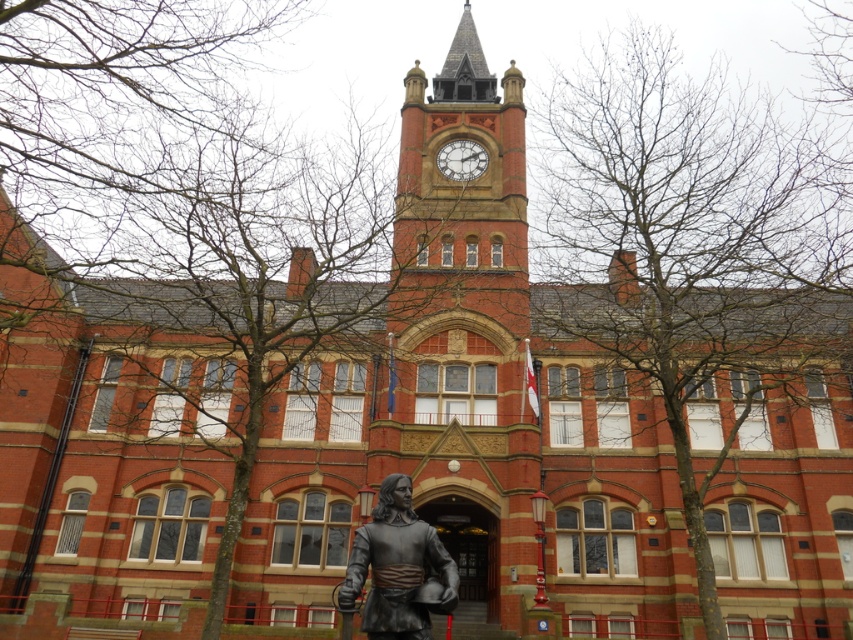
What are the coordinates of `bare branches at upper center` in the screenshot? It's located at (695, 246).

Locate an element on the screen. The image size is (853, 640). bare branches at upper center is located at coordinates (695, 246).

Does bare branches at upper center appear under bronze statue at center?

Actually, bare branches at upper center is above bronze statue at center.

Identify the location of bare branches at upper center. (695, 246).

The image size is (853, 640). What are the coordinates of `bare branches at upper center` in the screenshot? It's located at (695, 246).

Which of these two, bare branches at left or bronze statue at center, stands shorter?

Standing shorter between the two is bronze statue at center.

Describe the element at coordinates (119, 108) in the screenshot. I see `bare branches at left` at that location.

This screenshot has width=853, height=640. In order to click on bare branches at left in this screenshot , I will do `click(119, 108)`.